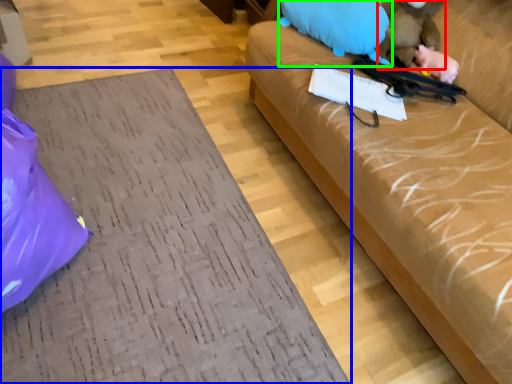
Question: Considering the real-world distances, which object is closest to animal (highlighted by a red box)? furniture (highlighted by a blue box) or animal (highlighted by a green box).

Choices:
 (A) furniture
 (B) animal

Answer: (B)